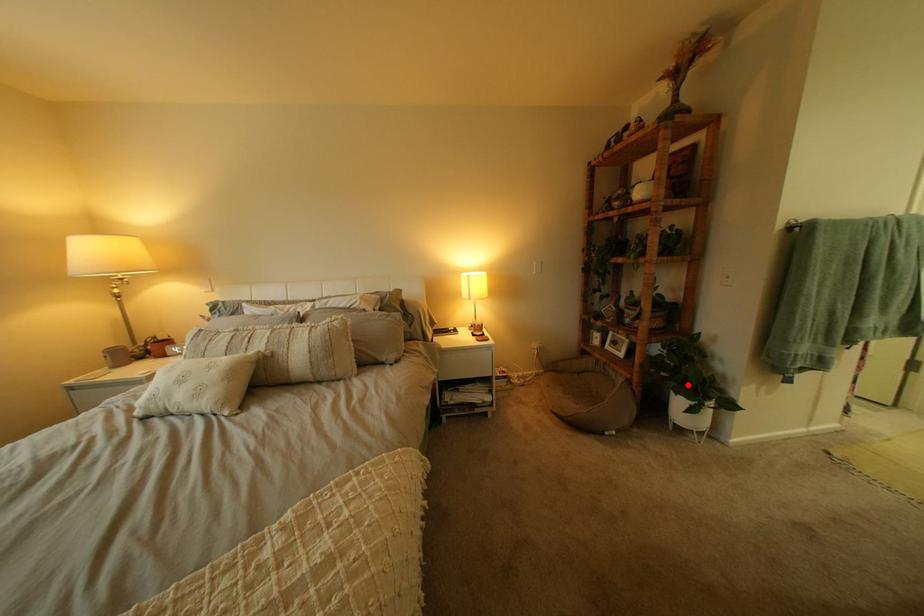
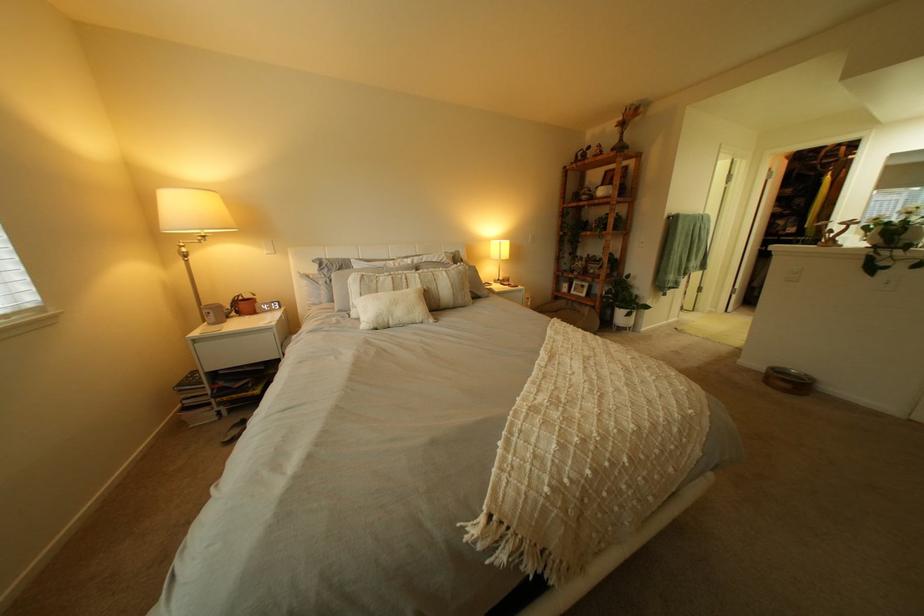
Question: I am providing you with two images of the same scene from different viewpoints. A red point is marked on the first image. Is the red point's position out of view in image 2?

Choices:
 (A) Yes
 (B) No

Answer: (B)